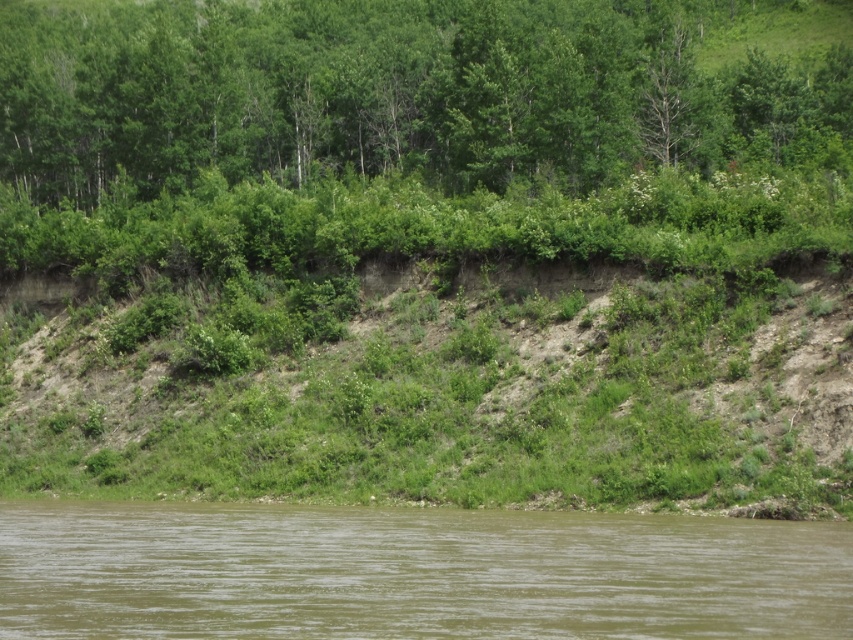
Question: Can you confirm if green leafy trees at upper center is positioned above brown muddy water at lower center?

Choices:
 (A) no
 (B) yes

Answer: (B)

Question: Observing the image, what is the correct spatial positioning of green leafy trees at upper center in reference to brown muddy water at lower center?

Choices:
 (A) right
 (B) left

Answer: (B)

Question: Among these objects, which one is nearest to the camera?

Choices:
 (A) brown muddy water at lower center
 (B) green leafy trees at upper center

Answer: (A)

Question: Does green leafy trees at upper center appear under brown muddy water at lower center?

Choices:
 (A) no
 (B) yes

Answer: (A)